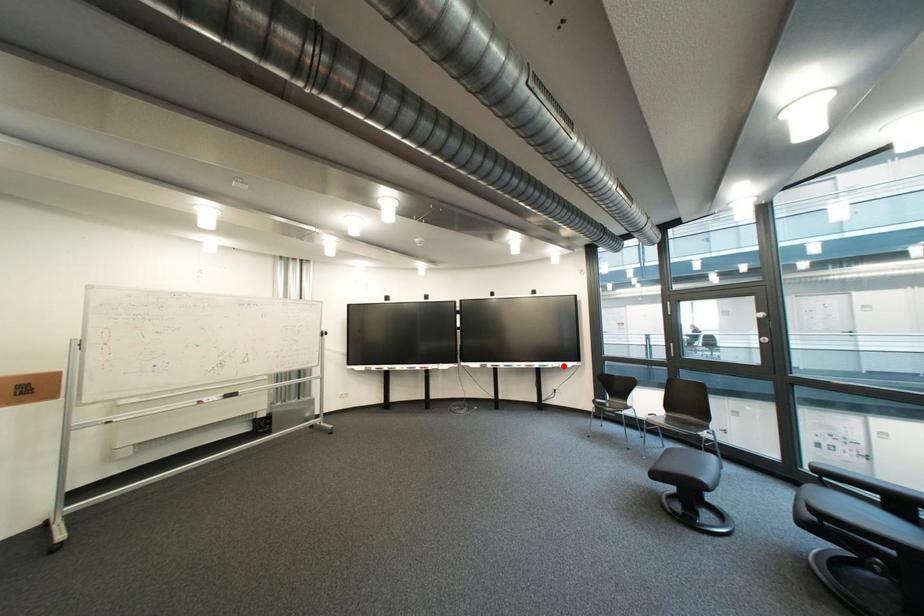
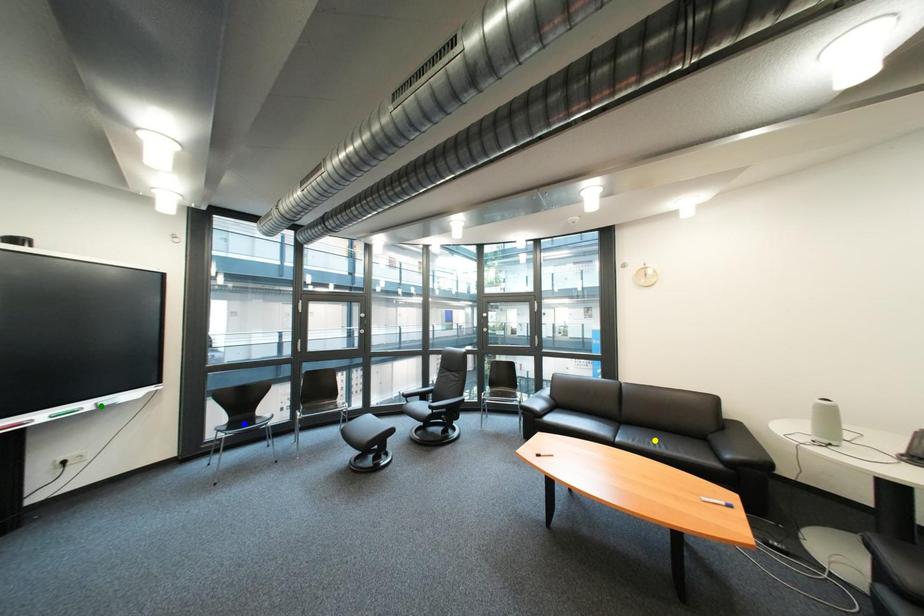
Question: I am providing you with two images of the same scene from different viewpoints. A red point is marked on the first image. You are given multiple points on the second image. Which spot in image 2 lines up with the point in image 1?

Choices:
 (A) green point
 (B) blue point
 (C) yellow point

Answer: (A)